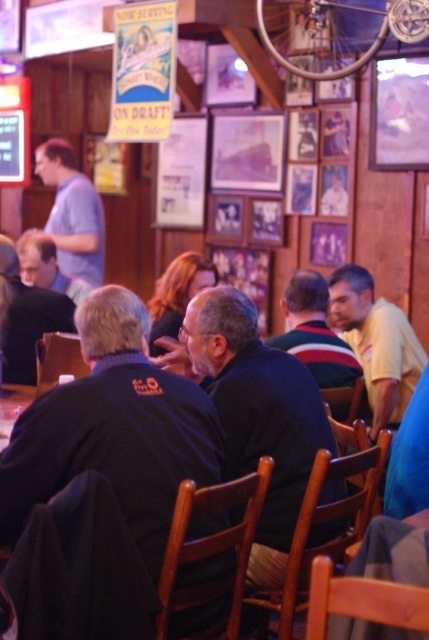
From the picture: Who is more forward, (272,525) or (72,189)?

Point (272,525)

Which of these two, dark blue sweater at center or light blue shirt at left, stands shorter?

dark blue sweater at center is shorter.

In order to click on dark blue sweater at center in this screenshot , I will do `click(256, 413)`.

From the picture: Is dark blue shirt at center positioned behind dark blue sweater at center?

That is False.

Does dark blue shirt at center appear under dark blue sweater at center?

Correct, dark blue shirt at center is located below dark blue sweater at center.

Find the location of a particular element. The image size is (429, 640). dark blue shirt at center is located at coordinates (114, 429).

Which of these two, dark blue shirt at center or light blue shirt at left, stands taller?

With more height is light blue shirt at left.

Describe the element at coordinates (114, 429) in the screenshot. I see `dark blue shirt at center` at that location.

You are a GUI agent. You are given a task and a screenshot of the screen. Output one action in this format:
    pyautogui.click(x=<x>, y=<y>)
    Task: Click on the dark blue shirt at center
    
    Given the screenshot: What is the action you would take?
    pyautogui.click(x=114, y=429)